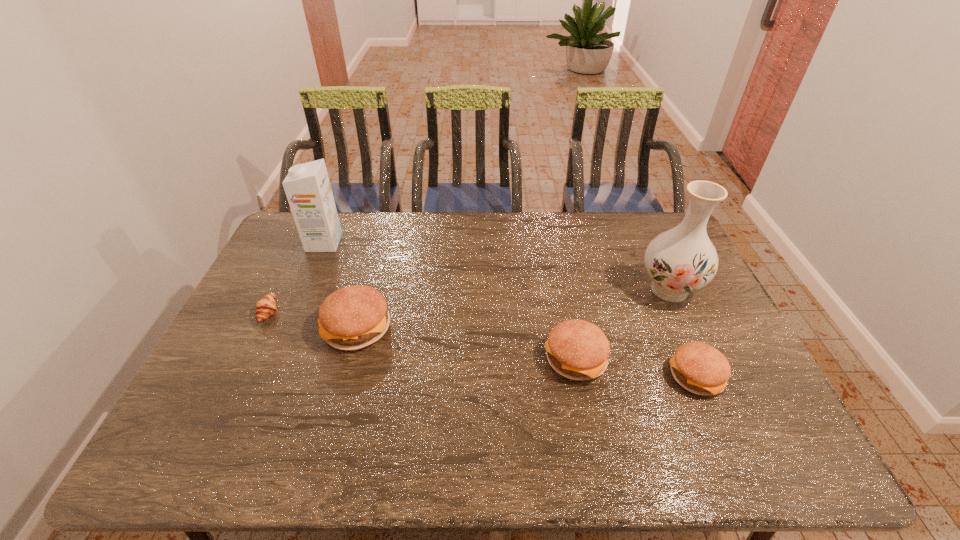
The image size is (960, 540). What are the coordinates of `the fourth object from right to left` in the screenshot? It's located at (351, 318).

Locate an element on the screen. This screenshot has width=960, height=540. the fourth tallest object is located at coordinates (576, 349).

Find the location of a particular element. the second shortest hamburger is located at coordinates (576, 349).

The width and height of the screenshot is (960, 540). I want to click on the second shortest object, so click(699, 368).

Find the location of a particular element. the rightmost hamburger is located at coordinates (699, 368).

Where is `the fifth shortest object`? This screenshot has height=540, width=960. the fifth shortest object is located at coordinates (x=307, y=187).

At what (x,y) coordinates should I click in order to perform the action: click on carton. Please return your answer as a coordinate pair (x, y). The height and width of the screenshot is (540, 960). Looking at the image, I should click on (307, 187).

The height and width of the screenshot is (540, 960). I want to click on the tallest object, so click(681, 260).

Locate an element on the screen. The image size is (960, 540). pastry is located at coordinates (266, 306).

Where is `vacant region located 0.120m on the front of the fourth object from right to left`? vacant region located 0.120m on the front of the fourth object from right to left is located at coordinates (340, 393).